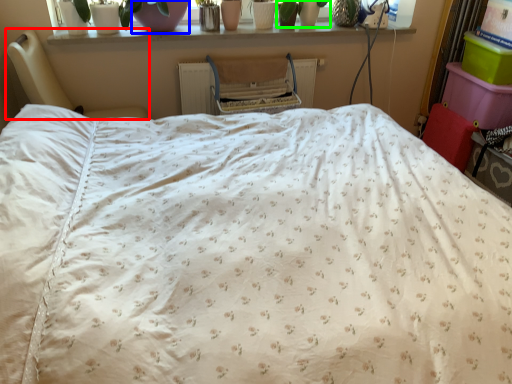
Question: Estimate the real-world distances between objects in this image. Which object is closer to furniture (highlighted by a red box), glass vase (highlighted by a blue box) or plant (highlighted by a green box)?

Choices:
 (A) glass vase
 (B) plant

Answer: (A)